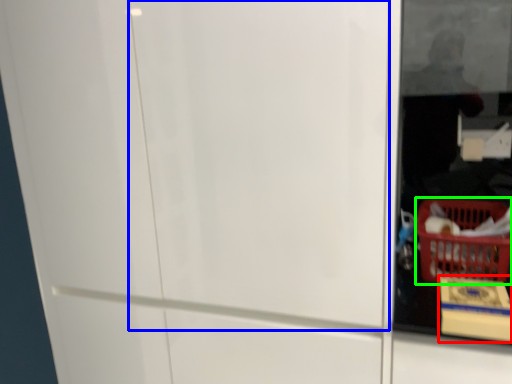
Question: Which object is positioned farthest from cardboard box (highlighted by a red box)? Select from screen door (highlighted by a blue box) and basket (highlighted by a green box).

Choices:
 (A) screen door
 (B) basket

Answer: (A)